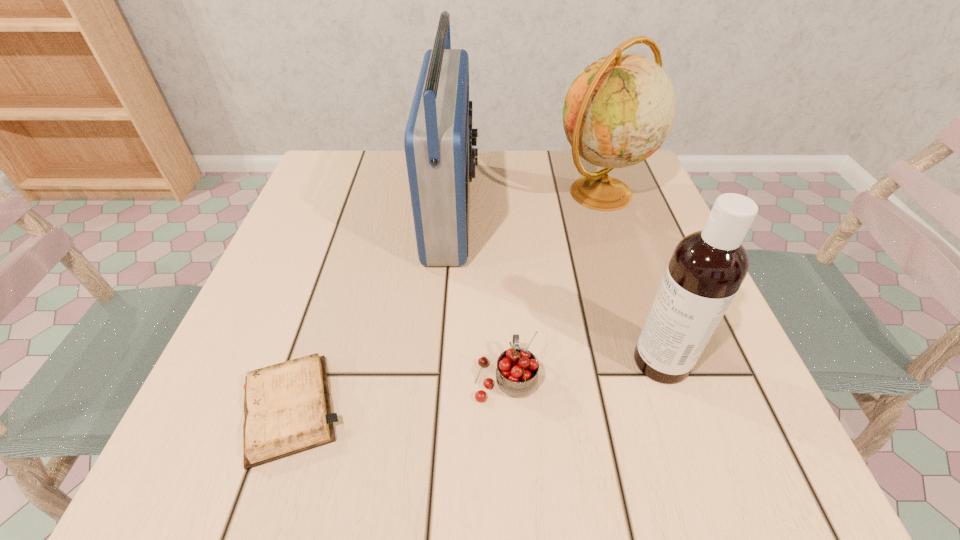
Where is `dishwasher detergent located at the right edge`? The width and height of the screenshot is (960, 540). dishwasher detergent located at the right edge is located at coordinates (707, 267).

I want to click on object located at the near left corner, so click(287, 409).

Where is `object situated at the far right corner`? object situated at the far right corner is located at coordinates (620, 109).

I want to click on vacant space at the far edge, so click(525, 180).

I want to click on vacant space at the near edge of the desktop, so click(x=516, y=452).

The image size is (960, 540). Find the location of `vacant space at the left edge of the desktop`. vacant space at the left edge of the desktop is located at coordinates (245, 310).

The width and height of the screenshot is (960, 540). Find the location of `free space at the right edge of the desktop`. free space at the right edge of the desktop is located at coordinates (657, 225).

This screenshot has height=540, width=960. What are the coordinates of `free space at the far left corner of the desktop` in the screenshot? It's located at (360, 184).

This screenshot has width=960, height=540. Identify the location of vacant space at the far right corner. (635, 181).

In order to click on free space between the cherry and the dishwasher detergent in this screenshot , I will do `click(584, 369)`.